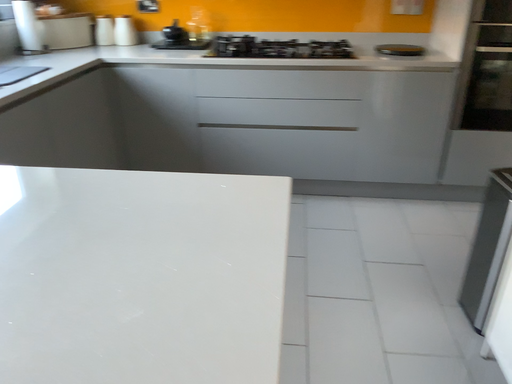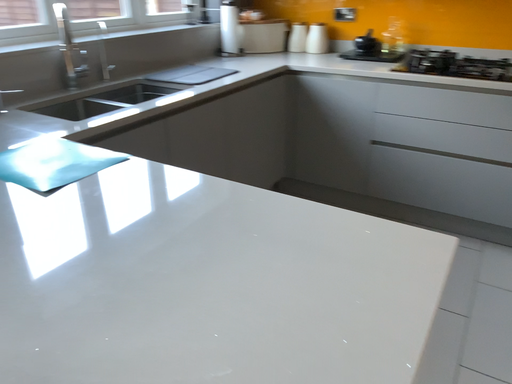
Question: Which way did the camera rotate in the video?

Choices:
 (A) rotated right
 (B) rotated left

Answer: (B)